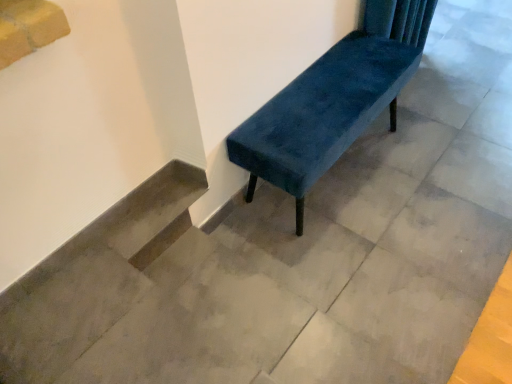
Find the location of `vacant area in front of velvet blue bench at center`. vacant area in front of velvet blue bench at center is located at coordinates (381, 265).